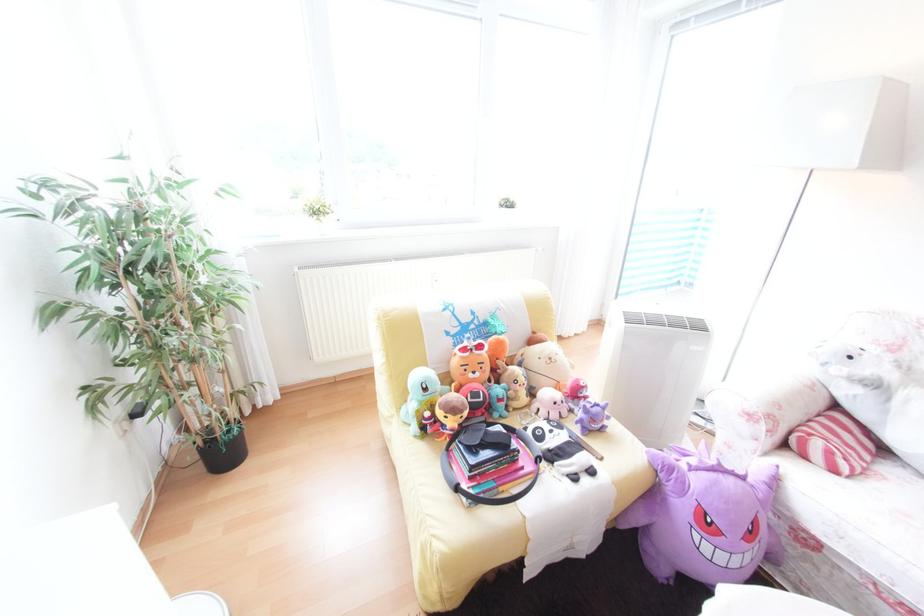
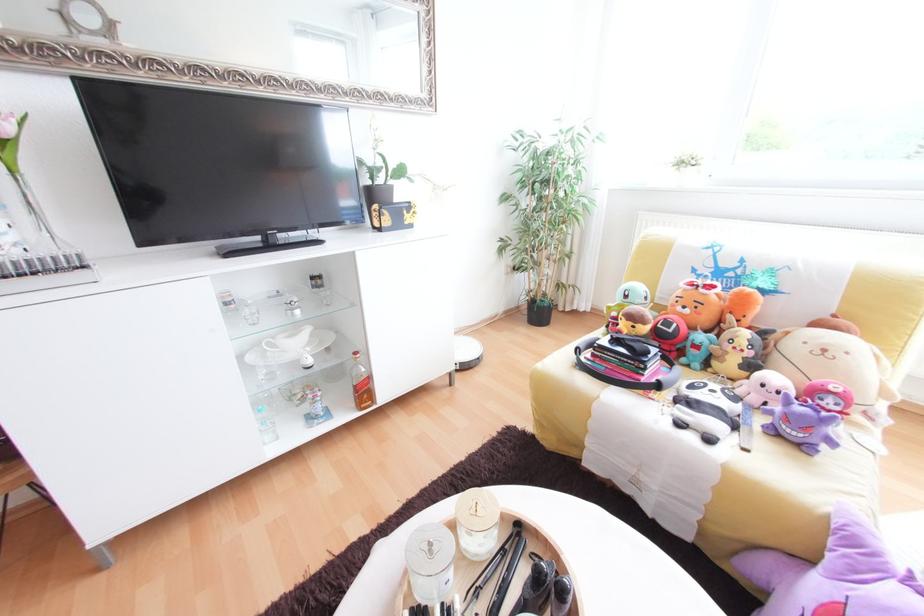
In the second image, find the point that corresponds to the point at 489,347 in the first image.

(719, 288)